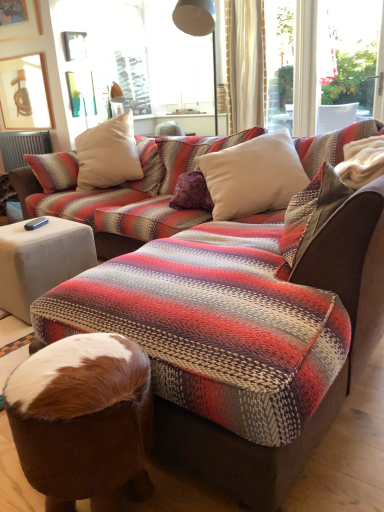
Identify the location of free space above white fabric side table at lower left (from a real-world perspective). This screenshot has height=512, width=384. (28, 224).